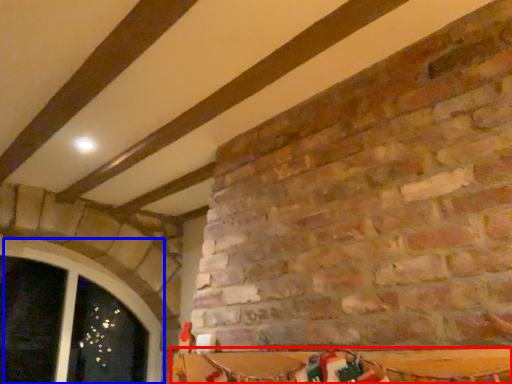
Question: Which object appears farthest to the camera in this image, table (highlighted by a red box) or window (highlighted by a blue box)?

Choices:
 (A) table
 (B) window

Answer: (B)